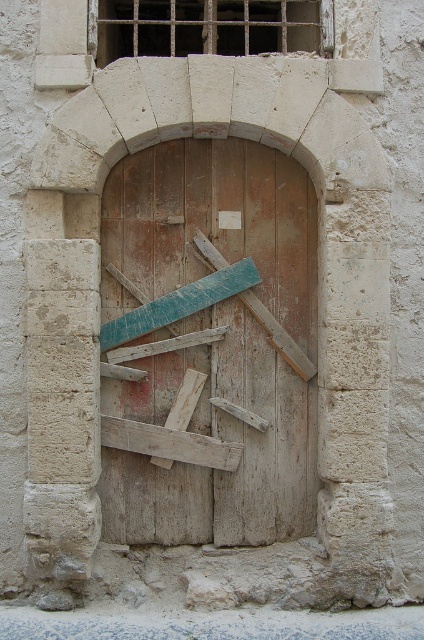
Is point (295, 180) positioned before point (226, 292)?

That is False.

Which is behind, point (156, 256) or point (159, 317)?

The point (156, 256) is behind.

Locate an element on the screen. This screenshot has width=424, height=640. weathered wood door at center is located at coordinates (223, 438).